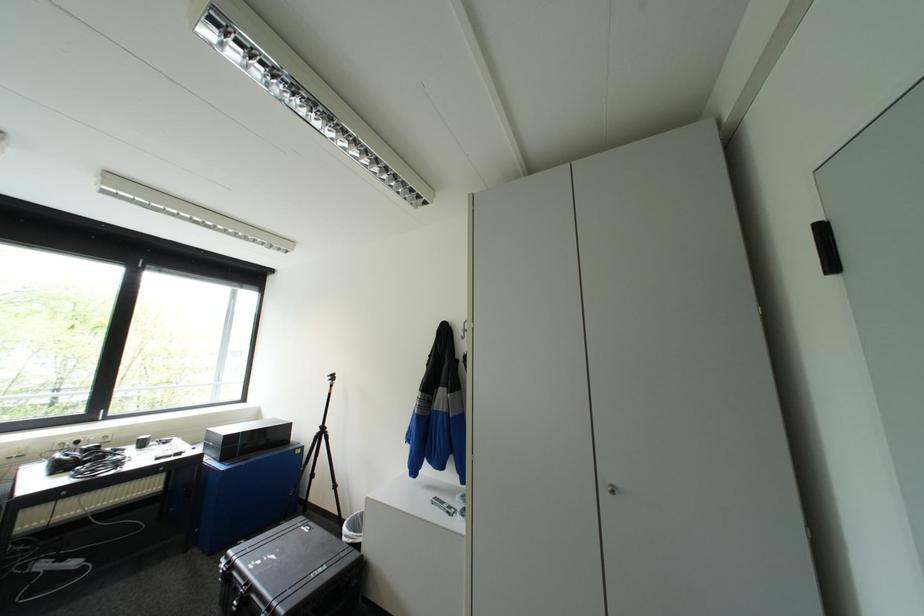
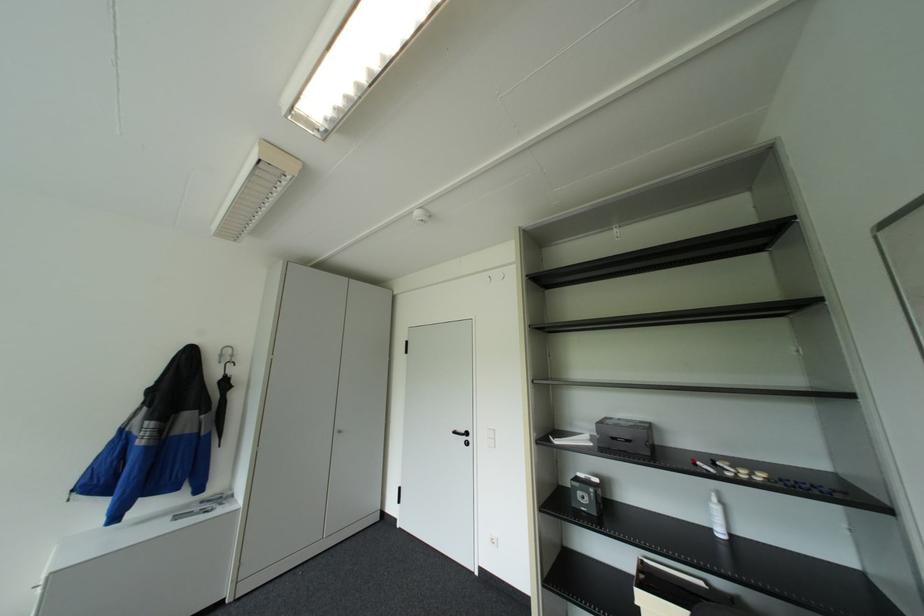
The point at (x=470, y=337) is marked in the first image. Where is the corresponding point in the second image?

(227, 361)